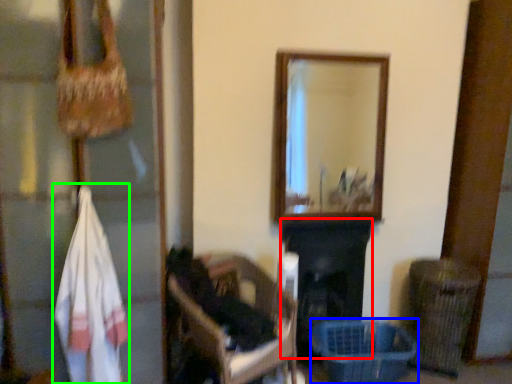
Question: Considering the real-world distances, which object is closest to fireplace (highlighted by a red box)? basket (highlighted by a blue box) or clothing (highlighted by a green box).

Choices:
 (A) basket
 (B) clothing

Answer: (A)